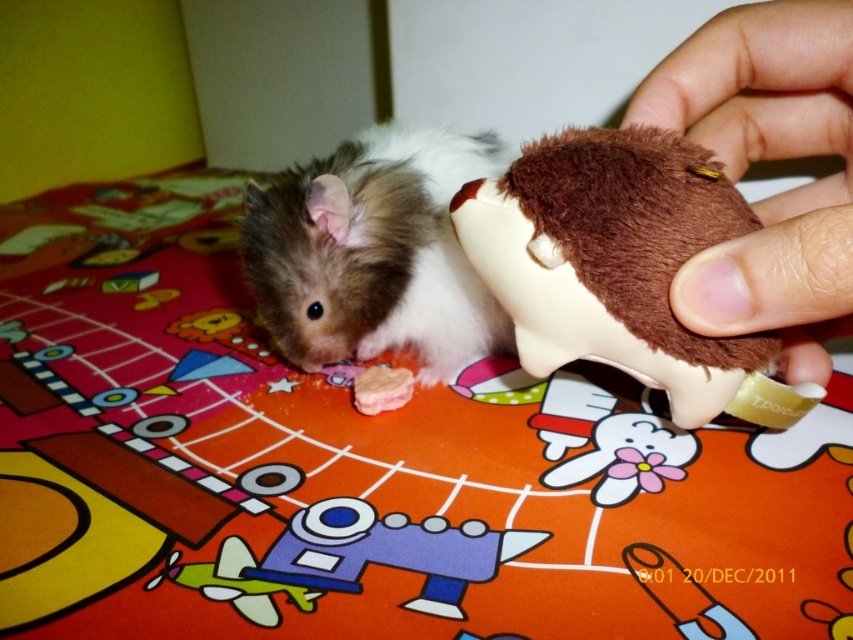
Which of these two, brown plush toy at center or fuzzy brown mouse at center, stands taller?

fuzzy brown mouse at center is taller.

Who is higher up, brown plush toy at center or fuzzy brown mouse at center?

fuzzy brown mouse at center is above.

Identify the location of brown plush toy at center. The width and height of the screenshot is (853, 640). (616, 262).

Locate an element on the screen. This screenshot has height=640, width=853. brown plush toy at center is located at coordinates (616, 262).

Between brown plush toy at center and brown fuzzy toy at upper right, which one appears on the right side from the viewer's perspective?

A: From the viewer's perspective, brown fuzzy toy at upper right appears more on the right side.

Is point (686, 422) less distant than point (729, 100)?

Yes, it is.

Where is `brown plush toy at center`? Image resolution: width=853 pixels, height=640 pixels. brown plush toy at center is located at coordinates (616, 262).

Who is more forward, (785, 326) or (421, 381)?

Positioned in front is point (785, 326).

Is brown fuzzy toy at upper right below fuzzy brown mouse at center?

Yes, brown fuzzy toy at upper right is below fuzzy brown mouse at center.

Is point (750, 136) farther from camera compared to point (456, 355)?

No, it is not.

The height and width of the screenshot is (640, 853). Identify the location of brown fuzzy toy at upper right. (769, 160).